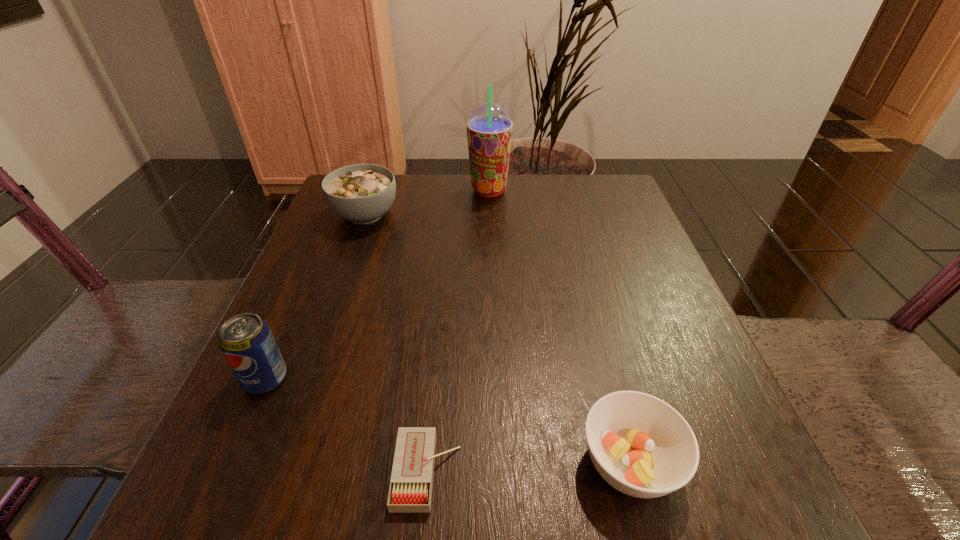
The width and height of the screenshot is (960, 540). I want to click on the fourth closest object relative to the nearer soup bowl, so click(489, 127).

Find the location of a particular element. The height and width of the screenshot is (540, 960). free spot that satisfies the following two spatial constraints: 1. on the front side of the nearer soup bowl; 2. on the left side of the third shortest object is located at coordinates (276, 463).